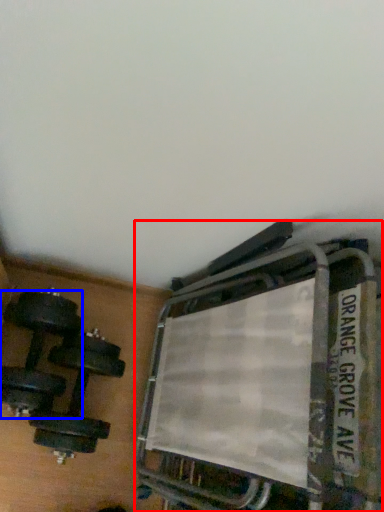
Question: Among these objects, which one is nearest to the camera, bunk bed (highlighted by a red box) or dumbbell (highlighted by a blue box)?

Choices:
 (A) bunk bed
 (B) dumbbell

Answer: (A)